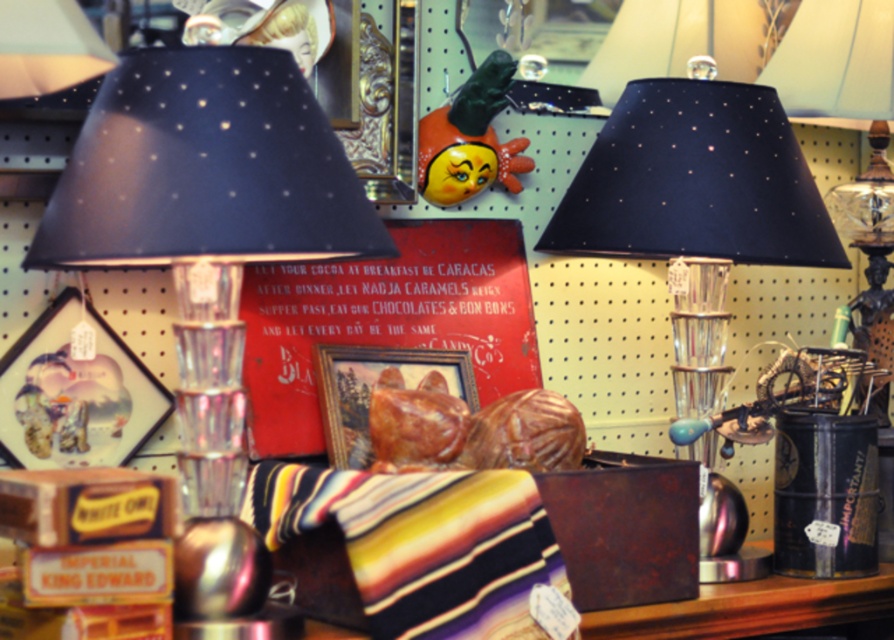
Between matte black lampshade at center and red cardboard sign at center, which one is positioned lower?

Positioned lower is red cardboard sign at center.

Is matte black lampshade at center below red cardboard sign at center?

No.

Does point (774, 141) lie behind point (457, 248)?

No.

You are a GUI agent. You are given a task and a screenshot of the screen. Output one action in this format:
    pyautogui.click(x=<x>, y=<y>)
    Task: Click on the matte black lampshade at center
    
    Given the screenshot: What is the action you would take?
    pyautogui.click(x=696, y=196)

Can you confirm if matte black lampshade at center is shorter than matte black lampshade at upper center?

Answer: Incorrect, matte black lampshade at center's height does not fall short of matte black lampshade at upper center's.

Can you confirm if matte black lampshade at center is wider than matte black lampshade at upper center?

Correct, the width of matte black lampshade at center exceeds that of matte black lampshade at upper center.

Is point (685, 157) more distant than point (842, 24)?

That is False.

Identify the location of matte black lampshade at center. 696,196.

Can you confirm if red cardboard sign at center is positioned to the left of matte black lampshade at upper center?

Yes, red cardboard sign at center is to the left of matte black lampshade at upper center.

Does point (537, 372) come behind point (870, 86)?

That is True.

The image size is (894, 640). I want to click on red cardboard sign at center, so (x=386, y=321).

This screenshot has width=894, height=640. In order to click on red cardboard sign at center in this screenshot , I will do `click(386, 321)`.